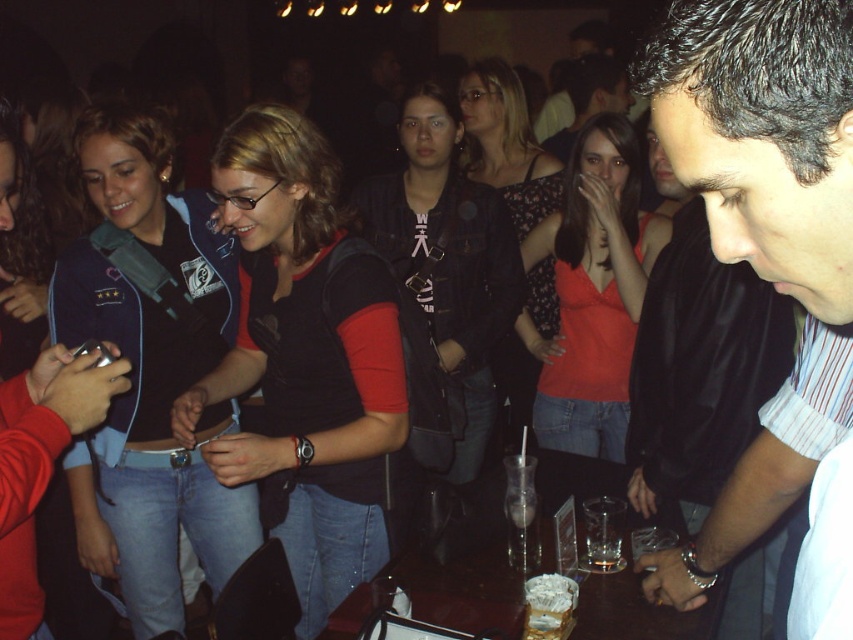
Question: Is floral-patterned top at center wider than smooth black shirt at center?

Choices:
 (A) no
 (B) yes

Answer: (A)

Question: Is black leather jacket at center smaller than smooth black shirt at center?

Choices:
 (A) yes
 (B) no

Answer: (A)

Question: Is floral-patterned top at center in front of translucent glass cup at table center?

Choices:
 (A) yes
 (B) no

Answer: (B)

Question: Which object is positioned farthest from the floral-patterned top at center?

Choices:
 (A) clear glass at center
 (B) matte red tank top at center
 (C) smooth black shirt at center

Answer: (A)

Question: Based on their relative distances, which object is farther from the floral-patterned top at center?

Choices:
 (A) denim jacket at left
 (B) clear glass at center

Answer: (B)

Question: Which object is the farthest from the black matte shirt at center?

Choices:
 (A) clear glass at center
 (B) smooth black shirt at center
 (C) floral-patterned top at center
 (D) translucent glass cup at table center

Answer: (B)